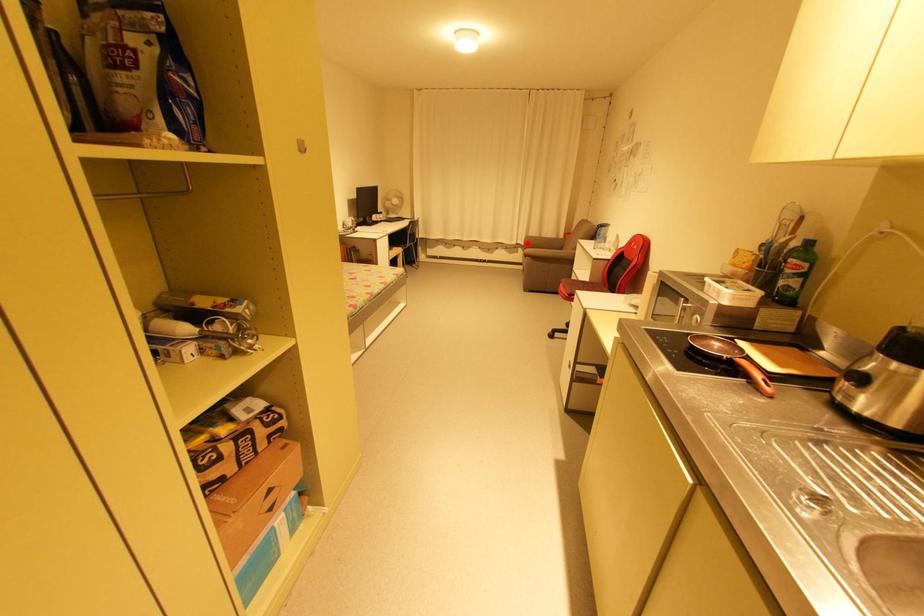
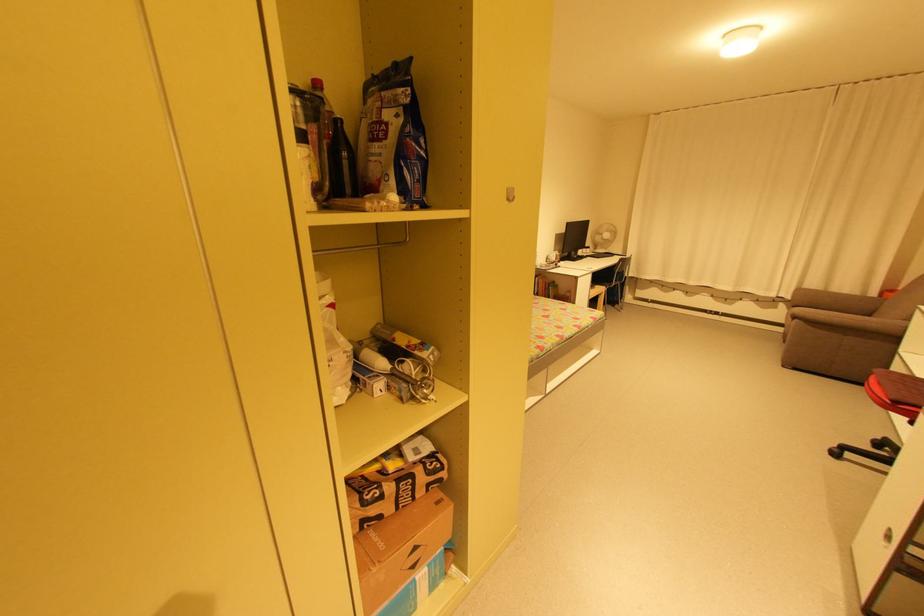
Where in the second image is the point corresponding to the highlighted location from the first image?

(794, 297)